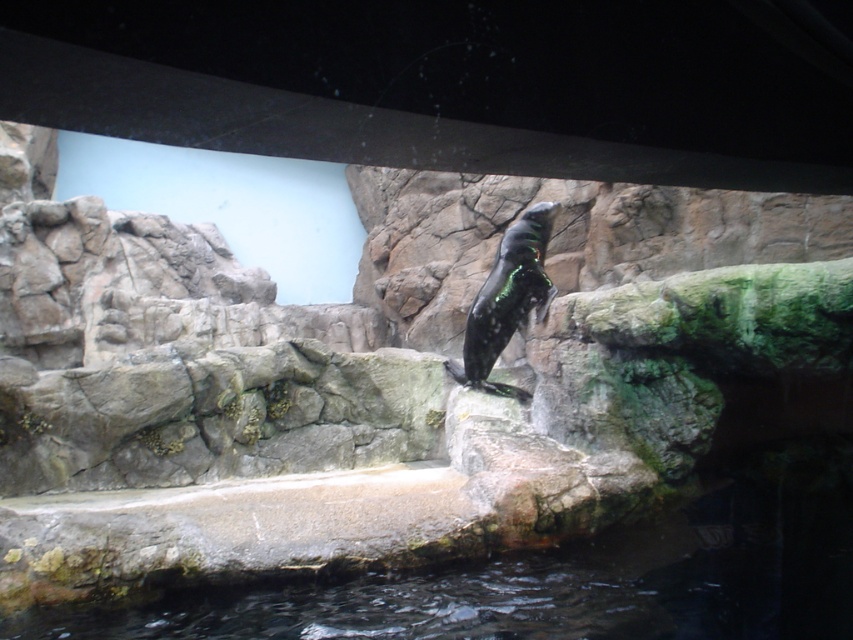
You are a zookeeper who needs to ensure the seal has enough space to move around. The seal is on the right side of the rocky outcrop. Based on the image, which object is taller, the clear water at lower center or the shiny black penguin at center?

The shiny black penguin at center is taller than the clear water at lower center according to the description.

You are a zookeeper who needs to check the water level in the seal exhibit. You see the clear water at lower center and the shiny black penguin at center. Which object is positioned lower in the scene?

The clear water at lower center is located below the shiny black penguin at center, so the clear water at lower center is positioned lower in the scene.